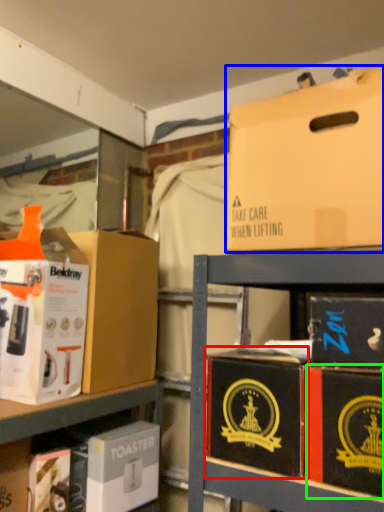
Question: Estimate the real-world distances between objects in this image. Which object is closer to box (highlighted by a red box), box (highlighted by a blue box) or box (highlighted by a green box)?

Choices:
 (A) box
 (B) box

Answer: (B)